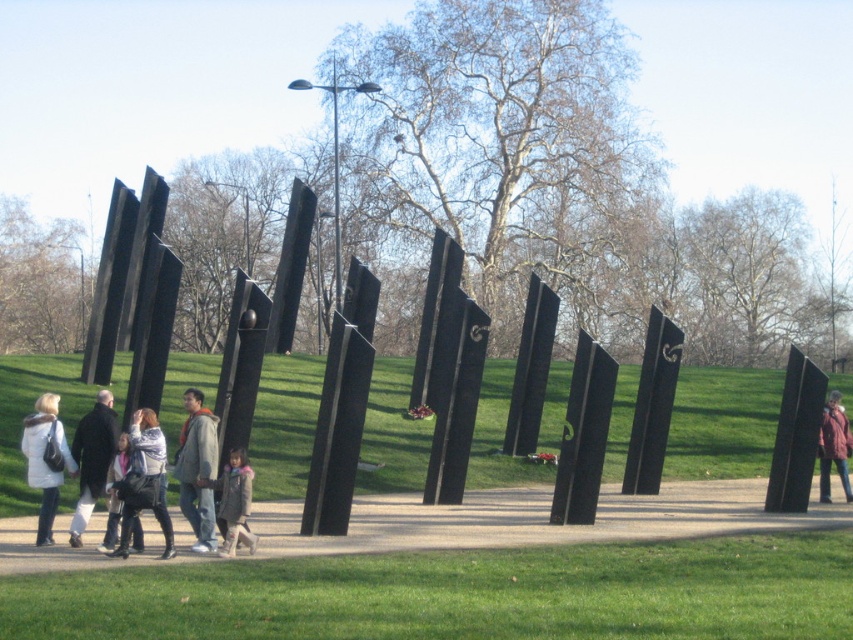
Question: Does polished black pillars at center have a smaller size compared to smooth concrete path at center?

Choices:
 (A) yes
 (B) no

Answer: (B)

Question: Does gray hoodie at center have a lesser width compared to light gray sweater at center?

Choices:
 (A) yes
 (B) no

Answer: (A)

Question: Which object is the farthest from the smooth concrete path at center?

Choices:
 (A) dark gray coat at center
 (B) white fleece jacket at lower left
 (C) polished black pillars at center

Answer: (B)

Question: Which object is closer to the camera taking this photo?

Choices:
 (A) white fleece jacket at lower left
 (B) matte red jacket at center
 (C) light gray sweater at center
 (D) smooth concrete path at center

Answer: (D)

Question: Does light gray sweater at center appear over matte black jacket at center?

Choices:
 (A) no
 (B) yes

Answer: (B)

Question: Among these objects, which one is farthest from the camera?

Choices:
 (A) matte black jacket at center
 (B) gray hoodie at center

Answer: (B)